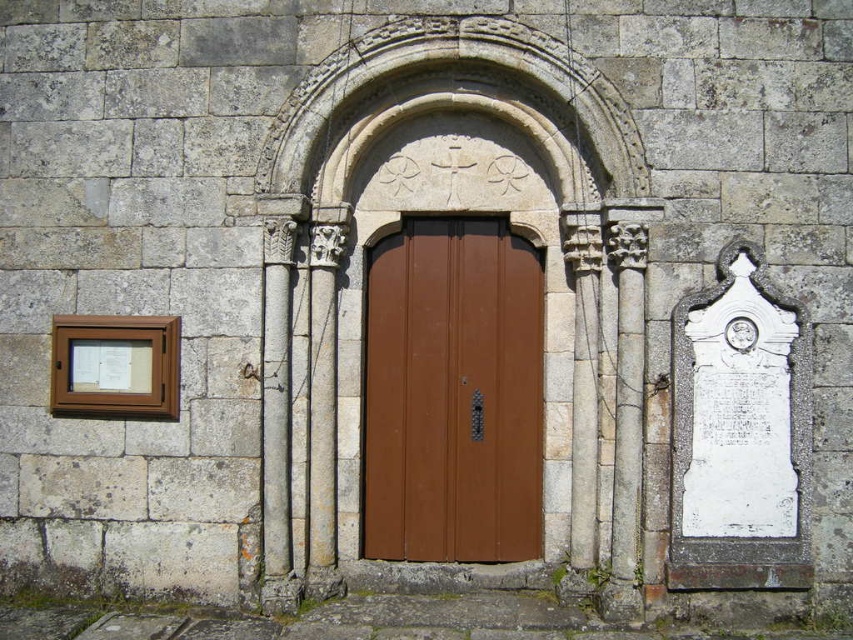
You are a painter who needs to place a 36 inch wide canvas between the brown matte door at center and the white stone column at center. Can the canvas fit in the space between them?

The brown matte door at center and white stone column at center are 37.93 inches apart from each other. Since the canvas is 36 inches wide, it can fit in the space between them as there is enough room.

You are an architect examining the historical structure. You notice the brown matte door at center and the white stone column at center. Which object is located to the right of the other?

The brown matte door at center is positioned on the right side of white stone column at center.